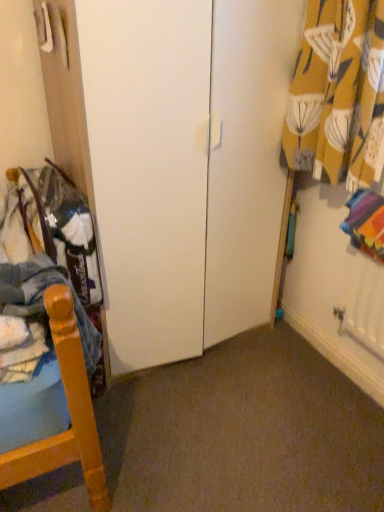
Locate an element on the screen. This screenshot has height=512, width=384. denim fabric pants at left is located at coordinates (43, 301).

Describe the element at coordinates (43, 301) in the screenshot. I see `denim fabric pants at left` at that location.

At what (x,y) coordinates should I click in order to perform the action: click on yellow floral fabric at upper right. Please return your answer as a coordinate pair (x, y). Looking at the image, I should click on (338, 94).

Image resolution: width=384 pixels, height=512 pixels. What do you see at coordinates (338, 94) in the screenshot?
I see `yellow floral fabric at upper right` at bounding box center [338, 94].

At what (x,y) coordinates should I click in order to perform the action: click on denim fabric pants at left. Please return your answer as a coordinate pair (x, y). Looking at the image, I should click on (43, 301).

Based on the photo, can you confirm if denim fabric pants at left is positioned to the left of yellow floral fabric at upper right?

Correct, you'll find denim fabric pants at left to the left of yellow floral fabric at upper right.

Does denim fabric pants at left lie behind yellow floral fabric at upper right?

No, denim fabric pants at left is in front of yellow floral fabric at upper right.

Does point (93, 327) appear closer or farther from the camera than point (348, 93)?

Point (93, 327).

From the image's perspective, is denim fabric pants at left located above yellow floral fabric at upper right?

No, from the image's perspective, denim fabric pants at left is not above yellow floral fabric at upper right.

From a real-world perspective, is denim fabric pants at left located beneath yellow floral fabric at upper right?

Yes.

In the scene shown: Is denim fabric pants at left thinner than yellow floral fabric at upper right?

Incorrect, the width of denim fabric pants at left is not less than that of yellow floral fabric at upper right.

From their relative heights in the image, would you say denim fabric pants at left is taller or shorter than yellow floral fabric at upper right?

Considering their sizes, denim fabric pants at left has less height than yellow floral fabric at upper right.

Can you confirm if denim fabric pants at left is bigger than yellow floral fabric at upper right?

No.

Would you say denim fabric pants at left is outside yellow floral fabric at upper right?

Yes, denim fabric pants at left is not within yellow floral fabric at upper right.

Are denim fabric pants at left and yellow floral fabric at upper right far apart?

No, denim fabric pants at left is in close proximity to yellow floral fabric at upper right.

Is denim fabric pants at left turned away from yellow floral fabric at upper right?

No, denim fabric pants at left is not facing the opposite direction of yellow floral fabric at upper right.

At what (x,y) coordinates should I click in order to perform the action: click on clothing located underneath the yellow floral fabric at upper right (from a real-world perspective). Please return your answer as a coordinate pair (x, y). Image resolution: width=384 pixels, height=512 pixels. Looking at the image, I should click on (43, 301).

Which object is positioned more to the left, yellow floral fabric at upper right or denim fabric pants at left?

denim fabric pants at left.

Is the position of yellow floral fabric at upper right less distant than that of denim fabric pants at left?

That is False.

Which is closer to the camera, (303, 76) or (67, 273)?

The point (67, 273) is in front.

From the image's perspective, which is above, yellow floral fabric at upper right or denim fabric pants at left?

yellow floral fabric at upper right.

From a real-world perspective, is yellow floral fabric at upper right on top of denim fabric pants at left?

Correct, in the physical world, yellow floral fabric at upper right is higher than denim fabric pants at left.

Considering the relative sizes of yellow floral fabric at upper right and denim fabric pants at left in the image provided, is yellow floral fabric at upper right thinner than denim fabric pants at left?

Yes.

Can you confirm if yellow floral fabric at upper right is taller than denim fabric pants at left?

Indeed, yellow floral fabric at upper right has a greater height compared to denim fabric pants at left.

In terms of size, does yellow floral fabric at upper right appear bigger or smaller than denim fabric pants at left?

Considering their sizes, yellow floral fabric at upper right takes up more space than denim fabric pants at left.

Is denim fabric pants at left completely or partially inside yellow floral fabric at upper right?

That's incorrect, denim fabric pants at left is not inside yellow floral fabric at upper right.

Is yellow floral fabric at upper right next to denim fabric pants at left and touching it?

No, yellow floral fabric at upper right is not next to denim fabric pants at left.

Is yellow floral fabric at upper right oriented towards denim fabric pants at left?

Yes, yellow floral fabric at upper right faces towards denim fabric pants at left.

This screenshot has height=512, width=384. I want to click on clothing in front of the yellow floral fabric at upper right, so click(x=43, y=301).

Locate an element on the screen. This screenshot has width=384, height=512. curtain above the denim fabric pants at left (from the image's perspective) is located at coordinates (338, 94).

Where is `clothing that appears on the left of yellow floral fabric at upper right`? clothing that appears on the left of yellow floral fabric at upper right is located at coordinates (43, 301).